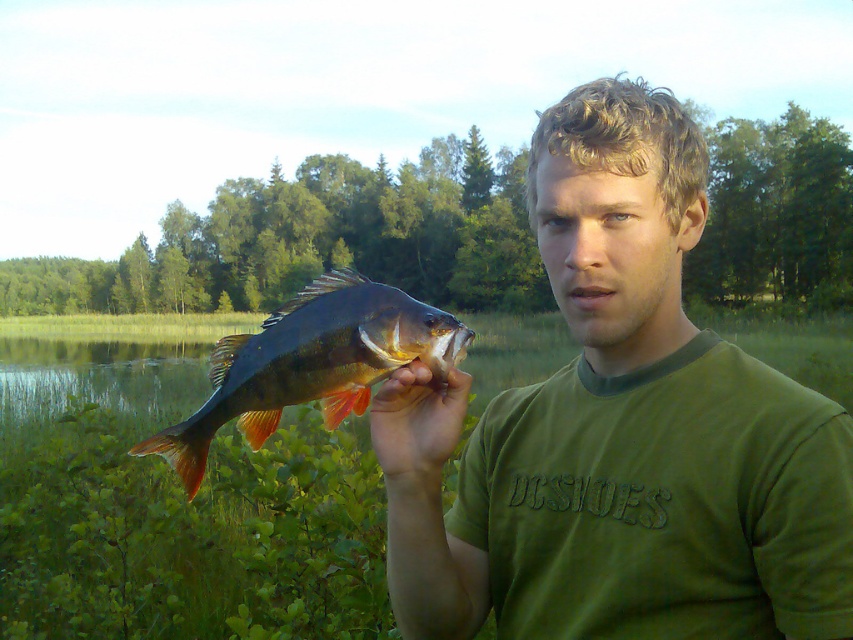
Looking at this image, does shiny metallic fish at center appear on the left side of smooth skin hand at center?

Indeed, shiny metallic fish at center is positioned on the left side of smooth skin hand at center.

Does shiny metallic fish at center have a greater width compared to smooth skin hand at center?

Yes.

Does point (325, 340) come behind point (397, 477)?

That is False.

The height and width of the screenshot is (640, 853). I want to click on shiny metallic fish at center, so click(310, 364).

Does green cotton shirt at center have a lesser width compared to smooth skin hand at center?

No.

Locate an element on the screen. This screenshot has height=640, width=853. green cotton shirt at center is located at coordinates (633, 432).

This screenshot has width=853, height=640. In order to click on green cotton shirt at center in this screenshot , I will do `click(633, 432)`.

Is green cotton shirt at center closer to the viewer compared to shiny metallic fish at center?

Yes, it is in front of shiny metallic fish at center.

Can you confirm if green cotton shirt at center is wider than shiny metallic fish at center?

Indeed, green cotton shirt at center has a greater width compared to shiny metallic fish at center.

The width and height of the screenshot is (853, 640). What do you see at coordinates (633, 432) in the screenshot?
I see `green cotton shirt at center` at bounding box center [633, 432].

You are a GUI agent. You are given a task and a screenshot of the screen. Output one action in this format:
    pyautogui.click(x=<x>, y=<y>)
    Task: Click on the green cotton shirt at center
    This screenshot has width=853, height=640.
    Given the screenshot: What is the action you would take?
    pyautogui.click(x=633, y=432)